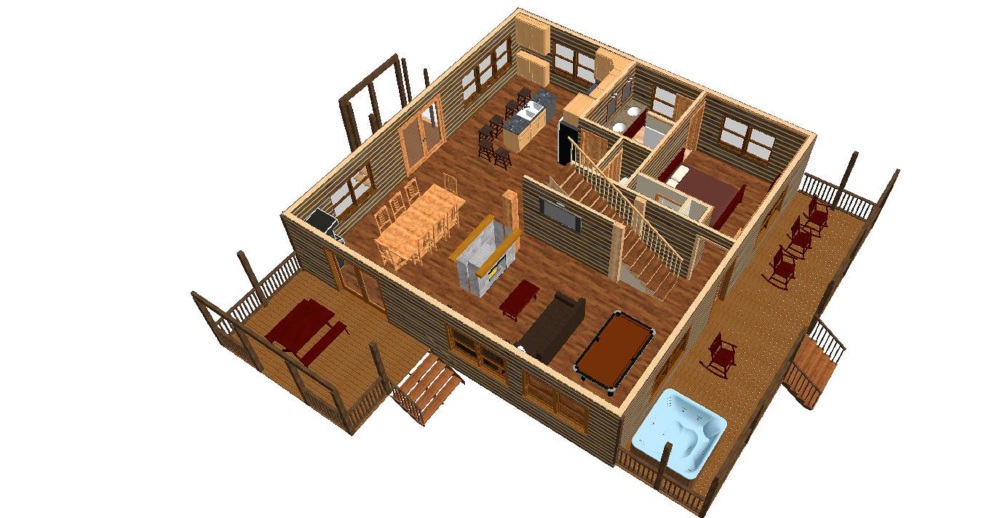
This screenshot has height=518, width=1000. In order to click on doors in this screenshot , I will do `click(726, 282)`, `click(407, 142)`, `click(366, 106)`, `click(346, 276)`.